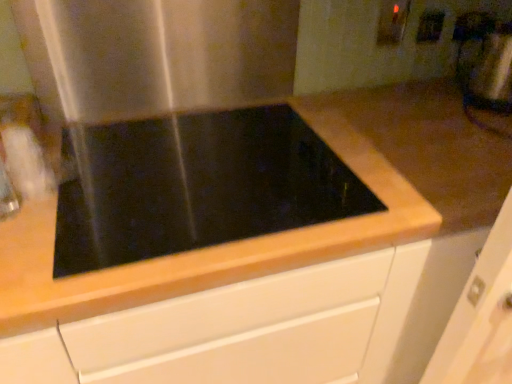
In order to click on white plastic electric outlet at upper right, the second electric outlet from the left in this screenshot , I will do `click(430, 26)`.

Locate an element on the screen. Image resolution: width=512 pixels, height=384 pixels. black glass cooktop at center is located at coordinates tap(195, 185).

What do you see at coordinates (195, 185) in the screenshot? I see `black glass cooktop at center` at bounding box center [195, 185].

I want to click on metallic silver blender at upper right, so click(484, 61).

In order to click on white plastic electric outlet at upper right, the first electric outlet from the right in this screenshot , I will do `click(430, 26)`.

Is matte white electric outlet at upper right, which is the 1th electric outlet from left to right, situated inside white plastic electric outlet at upper right, the first electric outlet from the right, or outside?

matte white electric outlet at upper right, which is the 1th electric outlet from left to right, cannot be found inside white plastic electric outlet at upper right, the first electric outlet from the right.

Considering the relative sizes of matte white electric outlet at upper right, which is the 2th electric outlet from right to left, and white plastic electric outlet at upper right, the first electric outlet from the right, in the image provided, is matte white electric outlet at upper right, which is the 2th electric outlet from right to left, smaller than white plastic electric outlet at upper right, the first electric outlet from the right,?

Incorrect, matte white electric outlet at upper right, which is the 2th electric outlet from right to left, is not smaller in size than white plastic electric outlet at upper right, the first electric outlet from the right.

Which object is wider, matte white electric outlet at upper right, which is the 2th electric outlet from right to left, or white plastic electric outlet at upper right, the second electric outlet from the left?

With larger width is matte white electric outlet at upper right, which is the 2th electric outlet from right to left.

Based on the photo, from a real-world perspective, is matte white electric outlet at upper right, which is the 2th electric outlet from right to left, on top of white plastic electric outlet at upper right, the second electric outlet from the left?

Yes, from a real-world perspective, matte white electric outlet at upper right, which is the 2th electric outlet from right to left, is above white plastic electric outlet at upper right, the second electric outlet from the left.

Which of these two, black glass cooktop at center or metallic silver blender at upper right, is smaller?

With smaller size is metallic silver blender at upper right.

Is metallic silver blender at upper right at the back of black glass cooktop at center?

No, black glass cooktop at center is not facing the opposite direction of metallic silver blender at upper right.

From the picture: Can you confirm if black glass cooktop at center is thinner than metallic silver blender at upper right?

In fact, black glass cooktop at center might be wider than metallic silver blender at upper right.

This screenshot has height=384, width=512. What are the coordinates of `blender above the black glass cooktop at center (from a real-world perspective)` in the screenshot? It's located at (484, 61).

From the image's perspective, between matte white electric outlet at upper right, which is the 1th electric outlet from left to right, and black glass cooktop at center, which one is located above?

matte white electric outlet at upper right, which is the 1th electric outlet from left to right, appears higher in the image.

Find the location of a particular element. The height and width of the screenshot is (384, 512). the 1st electric outlet behind the black glass cooktop at center is located at coordinates (392, 21).

In the scene shown: Choose the correct answer: Is matte white electric outlet at upper right, which is the 1th electric outlet from left to right, inside black glass cooktop at center or outside it?

matte white electric outlet at upper right, which is the 1th electric outlet from left to right, is outside black glass cooktop at center.

How different are the orientations of matte white electric outlet at upper right, which is the 2th electric outlet from right to left, and black glass cooktop at center in degrees?

1.85 degrees.

From the image's perspective, is metallic silver blender at upper right above matte white electric outlet at upper right, which is the 1th electric outlet from left to right?

Actually, metallic silver blender at upper right appears below matte white electric outlet at upper right, which is the 1th electric outlet from left to right, in the image.

Between point (507, 48) and point (395, 14), which one is positioned in front?

The point (507, 48) is more forward.

Is metallic silver blender at upper right directly adjacent to matte white electric outlet at upper right, which is the 2th electric outlet from right to left?

No, metallic silver blender at upper right is not with matte white electric outlet at upper right, which is the 2th electric outlet from right to left.

From a real-world perspective, is black glass cooktop at center under matte white electric outlet at upper right, which is the 1th electric outlet from left to right?

Yes, from a real-world perspective, black glass cooktop at center is beneath matte white electric outlet at upper right, which is the 1th electric outlet from left to right.

Which object is positioned more to the left, black glass cooktop at center or matte white electric outlet at upper right, which is the 2th electric outlet from right to left?

black glass cooktop at center.

Could you tell me if black glass cooktop at center is facing matte white electric outlet at upper right, which is the 1th electric outlet from left to right?

No, black glass cooktop at center does not turn towards matte white electric outlet at upper right, which is the 1th electric outlet from left to right.

Considering the sizes of objects white plastic electric outlet at upper right, the first electric outlet from the right, and stainless steel at upper left in the image provided, who is shorter, white plastic electric outlet at upper right, the first electric outlet from the right, or stainless steel at upper left?

With less height is white plastic electric outlet at upper right, the first electric outlet from the right.

In the scene shown: Is white plastic electric outlet at upper right, the second electric outlet from the left, to the right of stainless steel at upper left from the viewer's perspective?

Correct, you'll find white plastic electric outlet at upper right, the second electric outlet from the left, to the right of stainless steel at upper left.

Is white plastic electric outlet at upper right, the first electric outlet from the right, in front of or behind stainless steel at upper left in the image?

white plastic electric outlet at upper right, the first electric outlet from the right, is behind stainless steel at upper left.

How many degrees apart are the facing directions of stainless steel at upper left and black glass cooktop at center?

stainless steel at upper left and black glass cooktop at center are facing 0.132 degrees away from each other.

Based on their positions, is stainless steel at upper left located to the left or right of black glass cooktop at center?

From the image, it's evident that stainless steel at upper left is to the left of black glass cooktop at center.

In the scene shown: From a real-world perspective, between stainless steel at upper left and black glass cooktop at center, who is vertically higher?

In real-world perspective, stainless steel at upper left is above.

Relative to black glass cooktop at center, is stainless steel at upper left in front or behind?

stainless steel at upper left is behind black glass cooktop at center.

Identify the location of electric outlet located above the white plastic electric outlet at upper right, the first electric outlet from the right (from a real-world perspective). (392, 21).

The width and height of the screenshot is (512, 384). I want to click on gas stove below the metallic silver blender at upper right (from a real-world perspective), so click(x=195, y=185).

When comparing their distances from stainless steel at upper left, does matte white electric outlet at upper right, which is the 1th electric outlet from left to right, or metallic silver blender at upper right seem further?

Among the two, metallic silver blender at upper right is located further to stainless steel at upper left.

Estimate the real-world distances between objects in this image. Which object is further from stainless steel at upper left, white plastic electric outlet at upper right, the first electric outlet from the right, or black glass cooktop at center?

The object further to stainless steel at upper left is white plastic electric outlet at upper right, the first electric outlet from the right.

Consider the image. From the image, which object appears to be farther from matte white electric outlet at upper right, which is the 1th electric outlet from left to right, white plastic electric outlet at upper right, the second electric outlet from the left, or black glass cooktop at center?

The object further to matte white electric outlet at upper right, which is the 1th electric outlet from left to right, is black glass cooktop at center.

Looking at the image, which one is located further to metallic silver blender at upper right, white plastic electric outlet at upper right, the first electric outlet from the right, or matte white electric outlet at upper right, which is the 2th electric outlet from right to left?

matte white electric outlet at upper right, which is the 2th electric outlet from right to left, is further to metallic silver blender at upper right.

Consider the image. Based on their spatial positions, is stainless steel at upper left or black glass cooktop at center further from metallic silver blender at upper right?

The object further to metallic silver blender at upper right is black glass cooktop at center.

Which object lies further to the anchor point stainless steel at upper left, white plastic electric outlet at upper right, the first electric outlet from the right, or metallic silver blender at upper right?

metallic silver blender at upper right is further to stainless steel at upper left.

Based on the photo, which object lies further to the anchor point black glass cooktop at center, matte white electric outlet at upper right, which is the 2th electric outlet from right to left, or metallic silver blender at upper right?

The object further to black glass cooktop at center is metallic silver blender at upper right.

When comparing their distances from matte white electric outlet at upper right, which is the 1th electric outlet from left to right, does black glass cooktop at center or stainless steel at upper left seem further?

black glass cooktop at center is further to matte white electric outlet at upper right, which is the 1th electric outlet from left to right.

Locate an element on the screen. electric outlet between stainless steel at upper left and white plastic electric outlet at upper right, the first electric outlet from the right, in the horizontal direction is located at coordinates (392, 21).

Where is `gas stove situated between stainless steel at upper left and white plastic electric outlet at upper right, the first electric outlet from the right, from left to right`? The height and width of the screenshot is (384, 512). gas stove situated between stainless steel at upper left and white plastic electric outlet at upper right, the first electric outlet from the right, from left to right is located at coordinates (195, 185).

The image size is (512, 384). Identify the location of electric outlet between matte white electric outlet at upper right, which is the 2th electric outlet from right to left, and metallic silver blender at upper right from left to right. (430, 26).

Find the location of a particular element. Image resolution: width=512 pixels, height=384 pixels. gas stove situated between stainless steel at upper left and matte white electric outlet at upper right, which is the 2th electric outlet from right to left, from left to right is located at coordinates (195, 185).